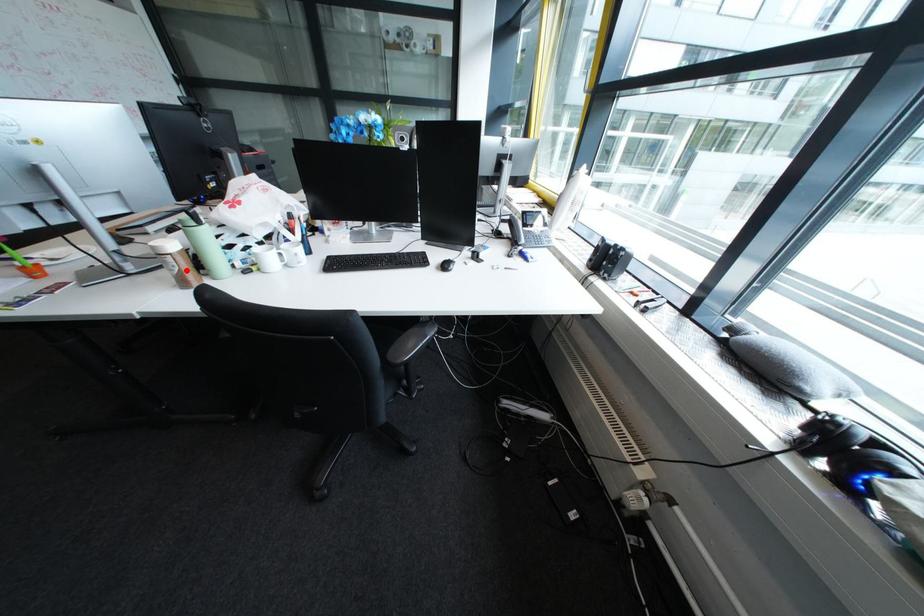
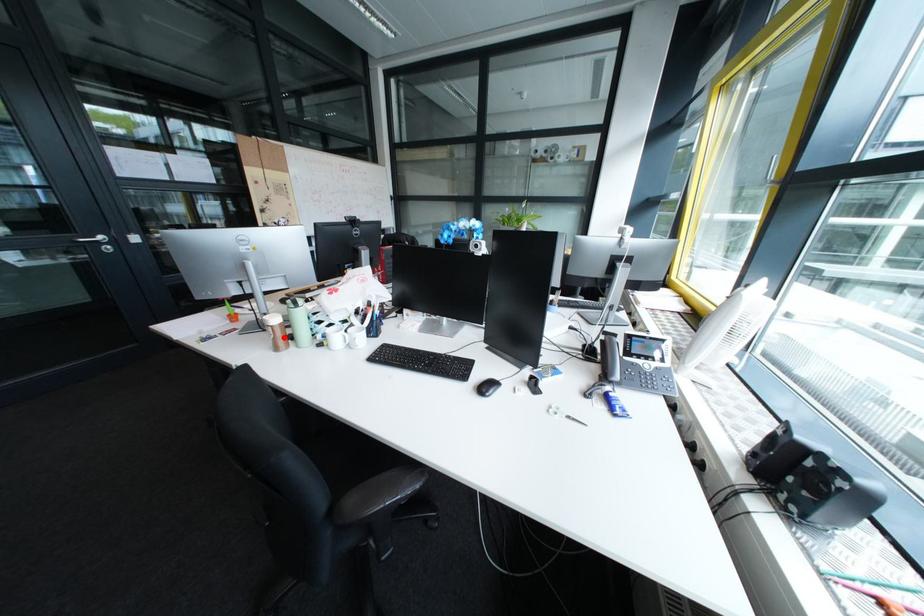
I am providing you with two images of the same scene from different viewpoints. A red point is marked on the first image and another point is marked on the second image. Do the highlighted points in image1 and image2 indicate the same real-world spot?

Yes